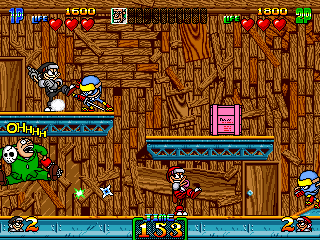
Where is `doors`? This screenshot has width=320, height=240. doors is located at coordinates (264, 187), (19, 83).